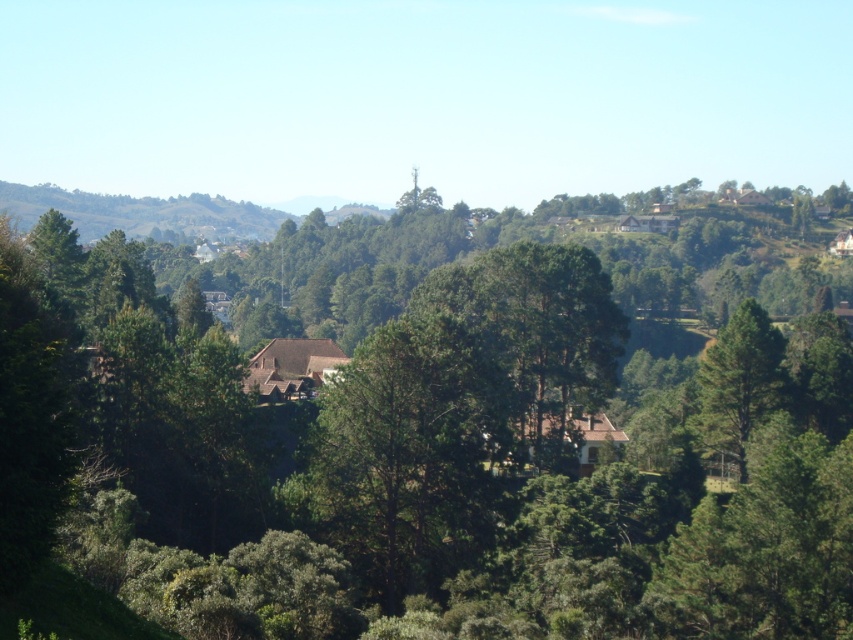
Question: Which object appears closest to the camera in this image?

Choices:
 (A) green matte tree at center
 (B) green leafy tree at center

Answer: (B)

Question: Which point is farther from the camera taking this photo?

Choices:
 (A) (695, 612)
 (B) (741, 444)

Answer: (B)

Question: Which of the following is the farthest from the observer?

Choices:
 (A) pyautogui.click(x=422, y=524)
 (B) pyautogui.click(x=755, y=316)

Answer: (B)

Question: In this image, where is green leafy tree at center located relative to green matte tree at center?

Choices:
 (A) above
 (B) below

Answer: (A)

Question: Does green leafy tree at center appear under green matte tree at center?

Choices:
 (A) no
 (B) yes

Answer: (A)

Question: Does green leafy tree at center have a smaller size compared to green matte tree at center?

Choices:
 (A) yes
 (B) no

Answer: (B)